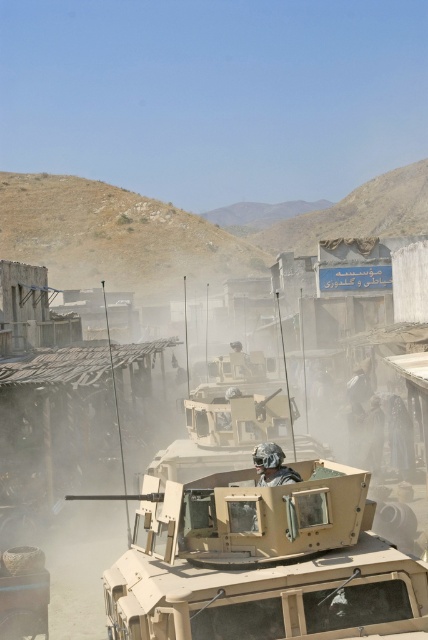
You are a military engineer assessing the space between two armored vehicles. You have a tan matte tank at center and a camouflage helmet at center. Which object is wider?

The tan matte tank at center is wider than the camouflage helmet at center.

You are a soldier positioned at point (270, 472) and need to move to point (281, 600). Given the terrain described in the scene, is there a clear path between these two points?

Point (281, 600) is in front of point (270, 472), so there is a clear path between them as long as there are no obstacles blocking the way between the two points.

You are a soldier in the field. You need to determine which object can be used to protect your head from falling debris. Which one should you choose between the tan matte tank at center and the camouflage helmet at center?

The camouflage helmet at center is designed to protect the head, while the tan matte tank at center is a large vehicle. You should choose the camouflage helmet at center for head protection.